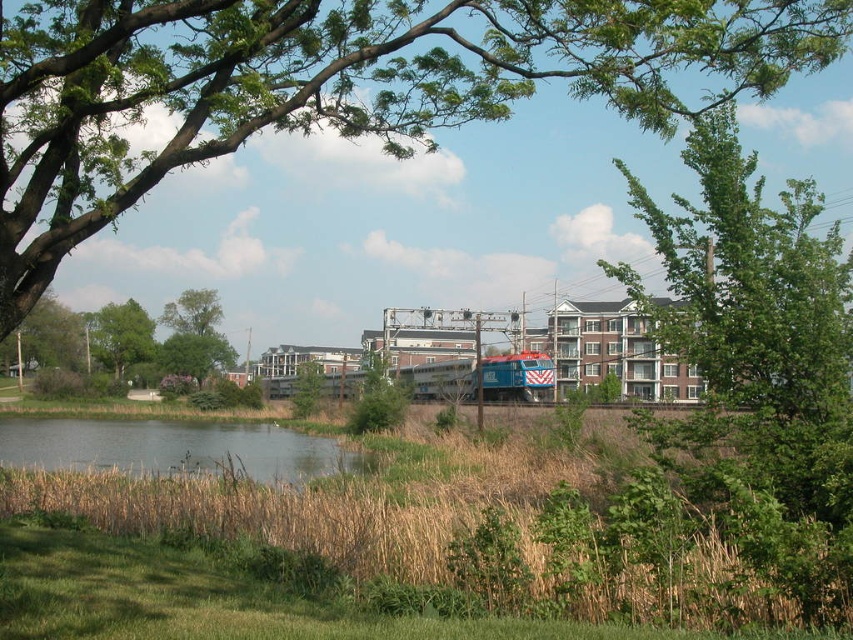
Does blue metallic passenger train at center lie behind green leafy tree at upper left?

Yes, it is behind green leafy tree at upper left.

Is blue metallic passenger train at center wider than green leafy tree at upper left?

Incorrect, blue metallic passenger train at center's width does not surpass green leafy tree at upper left's.

Who is more distant from viewer, (454, 385) or (19, 324)?

Point (19, 324)

Image resolution: width=853 pixels, height=640 pixels. What are the coordinates of `blue metallic passenger train at center` in the screenshot? It's located at (518, 378).

Who is shorter, green grassy river at lower left or green leafy tree at upper left?

With less height is green grassy river at lower left.

Who is lower down, green grassy river at lower left or green leafy tree at upper left?

green grassy river at lower left is lower down.

What do you see at coordinates (169, 448) in the screenshot?
I see `green grassy river at lower left` at bounding box center [169, 448].

Identify the location of green grassy river at lower left. This screenshot has height=640, width=853. (169, 448).

Is blue metallic passenger train at center behind green leafy tree at left?

No.

Between blue metallic passenger train at center and green leafy tree at left, which one appears on the left side from the viewer's perspective?

green leafy tree at left is more to the left.

In order to click on blue metallic passenger train at center in this screenshot , I will do `click(518, 378)`.